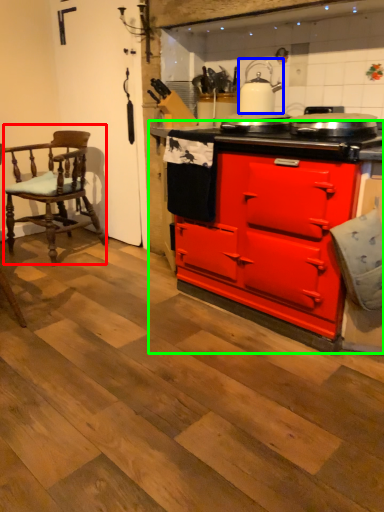
Question: Which object is positioned farthest from chair (highlighted by a red box)? Select from kitchen appliance (highlighted by a blue box) and cabinetry (highlighted by a green box).

Choices:
 (A) kitchen appliance
 (B) cabinetry

Answer: (A)